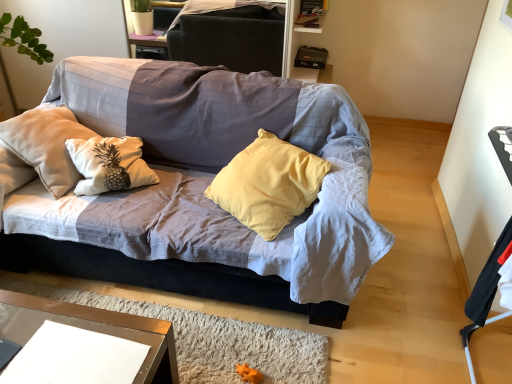
Question: In the image, is textured fabric couch at center positioned in front of or behind clear glass table at lower left?

Choices:
 (A) front
 (B) behind

Answer: (B)

Question: From the image's perspective, is textured fabric couch at center above or below clear glass table at lower left?

Choices:
 (A) below
 (B) above

Answer: (B)

Question: Which is farther from the dark gray fabric dresser at upper center?

Choices:
 (A) clear glass table at lower left
 (B) textured fabric couch at center
 (C) black fabric armchair at right

Answer: (C)

Question: Which is nearer to the black fabric armchair at right?

Choices:
 (A) clear glass table at lower left
 (B) dark gray fabric dresser at upper center
 (C) textured fabric couch at center

Answer: (C)